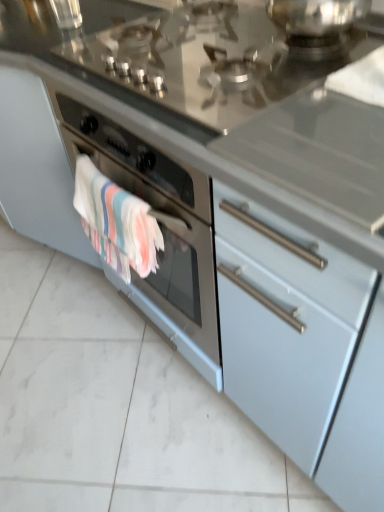
Question: From the image's perspective, relative to glossy stainless steel stovetop at upper center, is multicolored woven towel at lower left above or below?

Choices:
 (A) below
 (B) above

Answer: (A)

Question: Is multicolored woven towel at lower left taller or shorter than glossy stainless steel stovetop at upper center?

Choices:
 (A) tall
 (B) short

Answer: (A)

Question: Visually, is multicolored woven towel at lower left positioned to the left or to the right of glossy stainless steel stovetop at upper center?

Choices:
 (A) left
 (B) right

Answer: (A)

Question: Is glossy stainless steel stovetop at upper center inside the boundaries of multicolored woven towel at lower left, or outside?

Choices:
 (A) outside
 (B) inside

Answer: (A)

Question: In terms of size, does glossy stainless steel stovetop at upper center appear bigger or smaller than multicolored woven towel at lower left?

Choices:
 (A) small
 (B) big

Answer: (B)

Question: Is glossy stainless steel stovetop at upper center taller or shorter than multicolored woven towel at lower left?

Choices:
 (A) short
 (B) tall

Answer: (A)

Question: From the image's perspective, is glossy stainless steel stovetop at upper center above or below multicolored woven towel at lower left?

Choices:
 (A) below
 (B) above

Answer: (B)